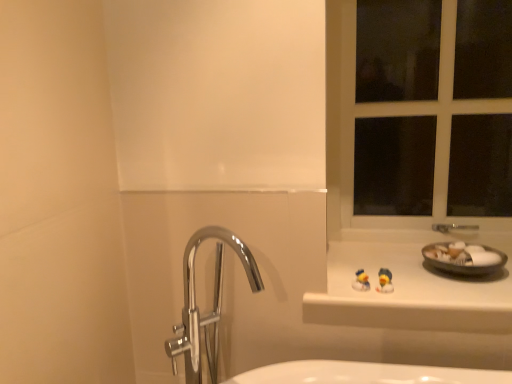
In order to click on free space to the right of blue rubber duck at center, which appears as the 1th miniature when viewed from the left in this screenshot , I will do `click(423, 291)`.